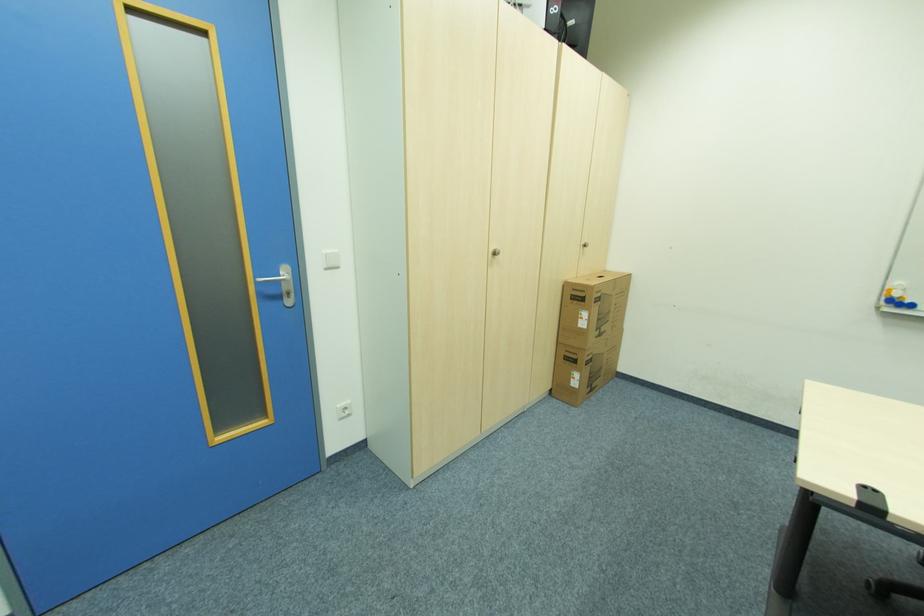
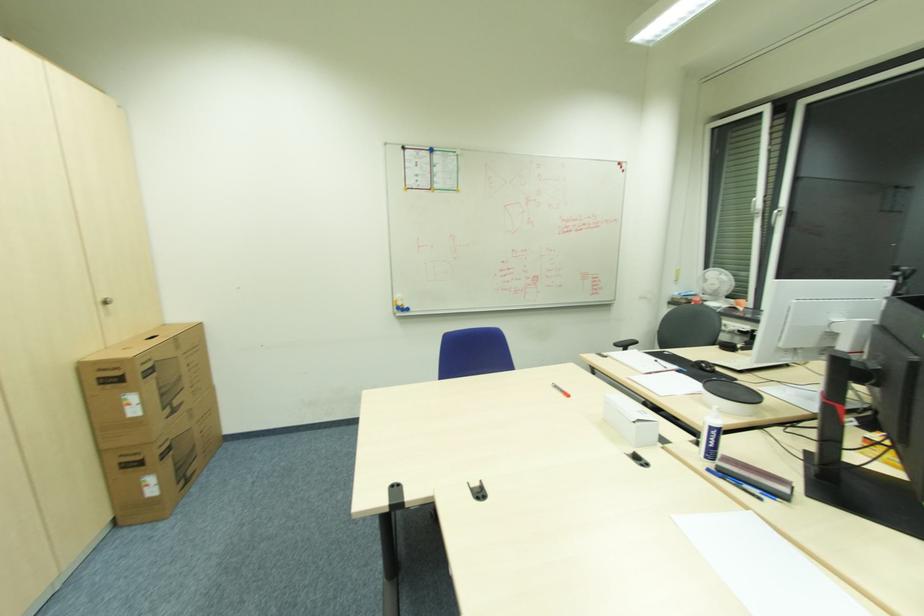
Question: The camera is either moving clockwise (left) or counter-clockwise (right) around the object. The first image is from the beginning of the video and the second image is from the end. Is the camera moving left or right when shooting the video?

Choices:
 (A) Left
 (B) Right

Answer: (A)